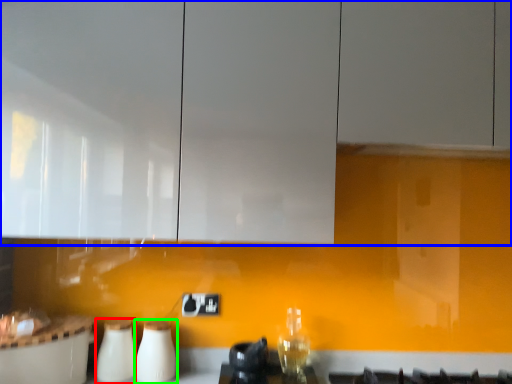
Question: Considering the real-world distances, which object is farthest from appliance (highlighted by a red box)? cabinetry (highlighted by a blue box) or appliance (highlighted by a green box)?

Choices:
 (A) cabinetry
 (B) appliance

Answer: (A)